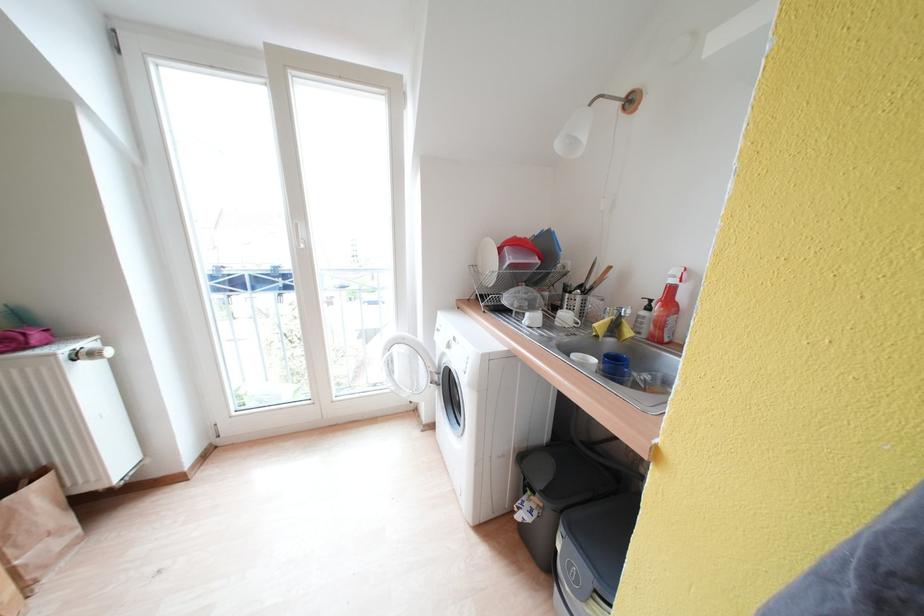
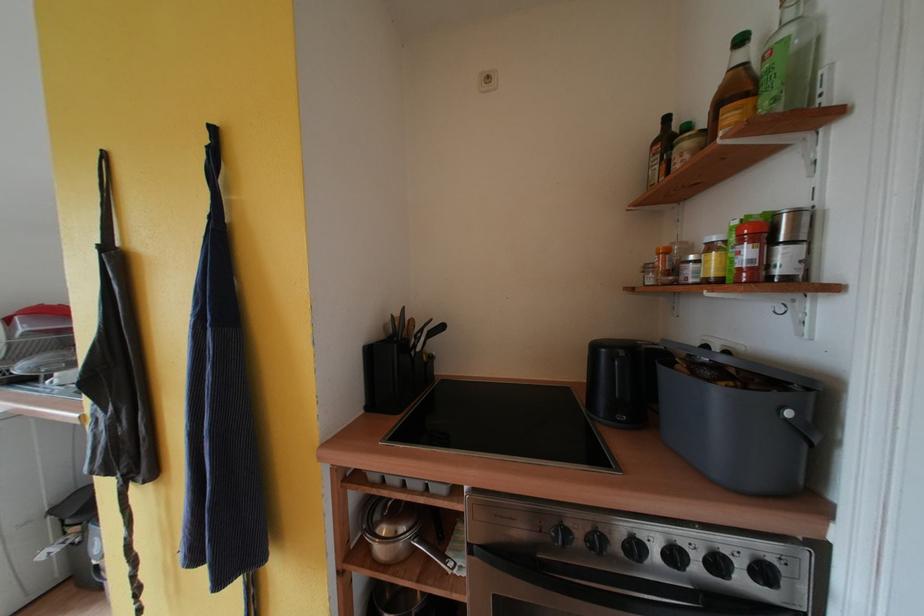
Question: I am providing you with two images of the same scene from different viewpoints. Which of the following objects are not visible in image2?

Choices:
 (A) knife handle
 (B) red bottle trigger
 (C) brown glass bottle
 (D) stuffed giraffe toy

Answer: (B)